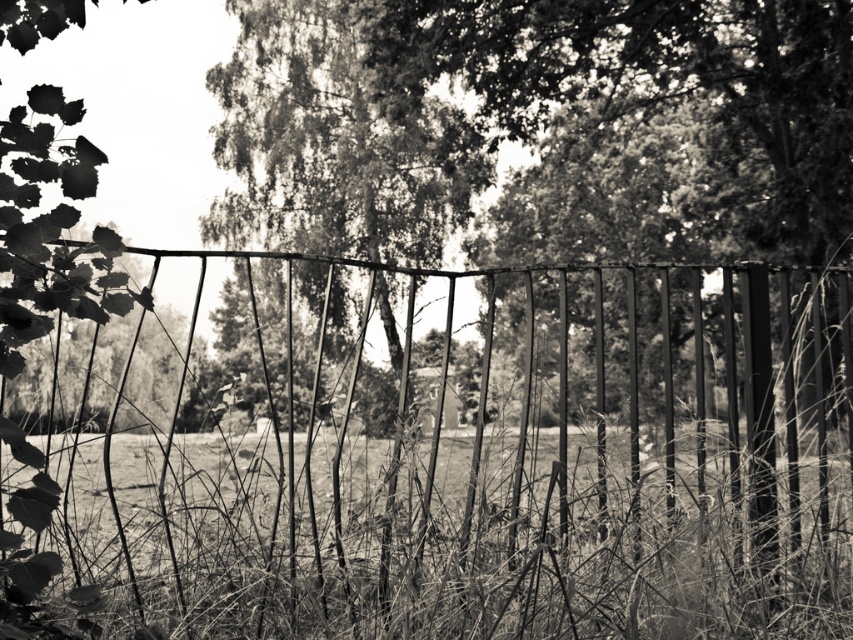
Is point (143, 513) closer to viewer compared to point (480, 138)?

Yes, it is.

Who is positioned more to the left, grainy textured grass at center or thick textured foliage at center?

From the viewer's perspective, grainy textured grass at center appears more on the left side.

Measure the distance between point (363, 515) and camera.

Point (363, 515) and camera are 6.51 meters apart from each other.

Image resolution: width=853 pixels, height=640 pixels. Identify the location of grainy textured grass at center. (415, 545).